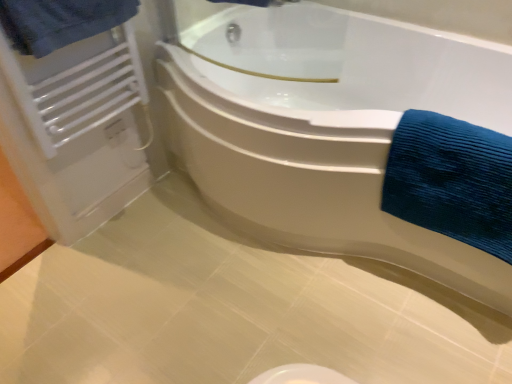
Describe the element at coordinates (451, 180) in the screenshot. I see `blue textured towel at right, the 1th bath towel from the right` at that location.

Locate an element on the screen. The width and height of the screenshot is (512, 384). blue textured towel at upper left, which ranks as the second bath towel in bottom-to-top order is located at coordinates (60, 21).

From a real-world perspective, which is physically below, white glossy bathtub at center or white metallic radiator at upper left?

white glossy bathtub at center, from a real-world perspective.

From the image's perspective, is white glossy bathtub at center located beneath white metallic radiator at upper left?

Indeed, from the image's perspective, white glossy bathtub at center is shown beneath white metallic radiator at upper left.

Is white glossy bathtub at center in front of or behind white metallic radiator at upper left in the image?

Visually, white glossy bathtub at center is located in front of white metallic radiator at upper left.

The width and height of the screenshot is (512, 384). In order to click on bath towel above the blue textured towel at right, the 1th bath towel from the right (from the image's perspective) in this screenshot , I will do `click(60, 21)`.

Considering the relative sizes of blue textured towel at right, which ranks as the first bath towel in bottom-to-top order, and blue textured towel at upper left, the 2th bath towel positioned from the right, in the image provided, is blue textured towel at right, which ranks as the first bath towel in bottom-to-top order, thinner than blue textured towel at upper left, the 2th bath towel positioned from the right,?

No.

How different are the orientations of blue textured towel at right, the 1th bath towel from the right, and blue textured towel at upper left, the 2th bath towel positioned from the right, in degrees?

blue textured towel at right, the 1th bath towel from the right, and blue textured towel at upper left, the 2th bath towel positioned from the right, are facing 89.5 degrees away from each other.

Which is closer to the camera, [499,238] or [415,121]?

Positioned in front is point [415,121].

What's the angular difference between blue textured towel at right, the 1th bath towel from the right, and white glossy bathtub at center's facing directions?

The angle between the facing direction of blue textured towel at right, the 1th bath towel from the right, and the facing direction of white glossy bathtub at center is 2.34 degrees.

Is white glossy bathtub at center at the back of blue textured towel at right, the 2th bath towel viewed from the left?

Yes.

From the image's perspective, between blue textured towel at right, which ranks as the first bath towel in bottom-to-top order, and white glossy bathtub at center, which one is located above?

white glossy bathtub at center, from the image's perspective.

Can you tell me how much white metallic radiator at upper left and blue textured towel at upper left, which appears as the 1th bath towel when viewed from the top, differ in facing direction?

They differ by 0.00124 degrees in their facing directions.

Is white metallic radiator at upper left positioned before blue textured towel at upper left, which ranks as the second bath towel in bottom-to-top order?

No, white metallic radiator at upper left is further to the viewer.

From a real-world perspective, which is physically below, white metallic radiator at upper left or blue textured towel at upper left, which ranks as the second bath towel in bottom-to-top order?

In real-world perspective, white metallic radiator at upper left is lower.

Does white metallic radiator at upper left have a larger size compared to blue textured towel at upper left, which ranks as the second bath towel in bottom-to-top order?

Indeed, white metallic radiator at upper left has a larger size compared to blue textured towel at upper left, which ranks as the second bath towel in bottom-to-top order.

Is the position of blue textured towel at right, which ranks as the first bath towel in bottom-to-top order, more distant than that of white metallic radiator at upper left?

No, the depth of blue textured towel at right, which ranks as the first bath towel in bottom-to-top order, is less than that of white metallic radiator at upper left.

Does blue textured towel at right, which ranks as the first bath towel in bottom-to-top order, appear on the left side of white metallic radiator at upper left?

In fact, blue textured towel at right, which ranks as the first bath towel in bottom-to-top order, is to the right of white metallic radiator at upper left.

From a real-world perspective, is blue textured towel at right, the 2th bath towel viewed from the left, over white metallic radiator at upper left?

Actually, blue textured towel at right, the 2th bath towel viewed from the left, is physically below white metallic radiator at upper left in the real world.

Locate an element on the screen. The image size is (512, 384). bath towel directly beneath the white metallic radiator at upper left (from a real-world perspective) is located at coordinates (451, 180).

Is white glossy bathtub at center facing away from blue textured towel at upper left, which appears as the 1th bath towel when viewed from the top?

No, white glossy bathtub at center is not facing the opposite direction of blue textured towel at upper left, which appears as the 1th bath towel when viewed from the top.

Can you tell me how much white glossy bathtub at center and blue textured towel at upper left, which appears as the 1th bath towel when viewed from the top, differ in facing direction?

white glossy bathtub at center and blue textured towel at upper left, which appears as the 1th bath towel when viewed from the top, are facing 91.8 degrees away from each other.

From the image's perspective, between white glossy bathtub at center and blue textured towel at upper left, which ranks as the second bath towel in bottom-to-top order, which one is located above?

blue textured towel at upper left, which ranks as the second bath towel in bottom-to-top order, appears higher in the image.

Is white glossy bathtub at center taller than blue textured towel at upper left, which appears as the 1th bath towel when viewed from the top?

Yes, white glossy bathtub at center is taller than blue textured towel at upper left, which appears as the 1th bath towel when viewed from the top.

How distant is blue textured towel at upper left, which ranks as the second bath towel in bottom-to-top order, from blue textured towel at right, the 1th bath towel from the right?

A distance of 3.51 feet exists between blue textured towel at upper left, which ranks as the second bath towel in bottom-to-top order, and blue textured towel at right, the 1th bath towel from the right.

Considering the relative sizes of blue textured towel at upper left, the 2th bath towel positioned from the right, and blue textured towel at right, the 1th bath towel from the right, in the image provided, is blue textured towel at upper left, the 2th bath towel positioned from the right, smaller than blue textured towel at right, the 1th bath towel from the right,?

Yes.

Consider the image. Can you tell me how much blue textured towel at upper left, the 2th bath towel positioned from the right, and blue textured towel at right, the 2th bath towel viewed from the left, differ in facing direction?

There is a 89.5-degree angle between the facing directions of blue textured towel at upper left, the 2th bath towel positioned from the right, and blue textured towel at right, the 2th bath towel viewed from the left.

From the picture: From the image's perspective, is blue textured towel at upper left, the 2th bath towel positioned from the right, above or below blue textured towel at right, placed as the second bath towel when sorted from top to bottom?

Based on their image positions, blue textured towel at upper left, the 2th bath towel positioned from the right, is located above blue textured towel at right, placed as the second bath towel when sorted from top to bottom.

In order to click on radiator on the left of the white glossy bathtub at center in this screenshot , I will do `click(75, 86)`.

Identify the location of bath towel that appears below the blue textured towel at upper left, which ranks as the second bath towel in bottom-to-top order (from a real-world perspective). (451, 180).

Consider the image. When comparing their distances from white metallic radiator at upper left, does blue textured towel at right, the 1th bath towel from the right, or white glossy bathtub at center seem further?

The object further to white metallic radiator at upper left is blue textured towel at right, the 1th bath towel from the right.

When comparing their distances from white glossy bathtub at center, does white metallic radiator at upper left or blue textured towel at upper left, the 1th bath towel in the left-to-right sequence, seem further?

The object further to white glossy bathtub at center is blue textured towel at upper left, the 1th bath towel in the left-to-right sequence.

From the image, which object appears to be farther from blue textured towel at upper left, the 1th bath towel in the left-to-right sequence, blue textured towel at right, which ranks as the first bath towel in bottom-to-top order, or white metallic radiator at upper left?

blue textured towel at right, which ranks as the first bath towel in bottom-to-top order.

Which object lies nearer to the anchor point blue textured towel at right, which ranks as the first bath towel in bottom-to-top order, white glossy bathtub at center or white metallic radiator at upper left?

Based on the image, white glossy bathtub at center appears to be nearer to blue textured towel at right, which ranks as the first bath towel in bottom-to-top order.

Consider the image. Which object lies further to the anchor point white glossy bathtub at center, blue textured towel at right, the 2th bath towel viewed from the left, or white metallic radiator at upper left?

white metallic radiator at upper left.

When comparing their distances from white metallic radiator at upper left, does blue textured towel at upper left, the 1th bath towel in the left-to-right sequence, or white glossy bathtub at center seem further?

Based on the image, white glossy bathtub at center appears to be further to white metallic radiator at upper left.

From the image, which object appears to be farther from white metallic radiator at upper left, white glossy bathtub at center or blue textured towel at upper left, which ranks as the second bath towel in bottom-to-top order?

white glossy bathtub at center lies further to white metallic radiator at upper left than the other object.

Estimate the real-world distances between objects in this image. Which object is further from blue textured towel at upper left, the 2th bath towel positioned from the right, white metallic radiator at upper left or blue textured towel at right, the 2th bath towel viewed from the left?

The object further to blue textured towel at upper left, the 2th bath towel positioned from the right, is blue textured towel at right, the 2th bath towel viewed from the left.

The height and width of the screenshot is (384, 512). In order to click on bathtub situated between white metallic radiator at upper left and blue textured towel at right, placed as the second bath towel when sorted from top to bottom, from left to right in this screenshot , I will do `click(342, 139)`.

Identify the location of bath towel situated between white metallic radiator at upper left and blue textured towel at right, which ranks as the first bath towel in bottom-to-top order, from left to right. This screenshot has height=384, width=512. (60, 21).

This screenshot has height=384, width=512. I want to click on bath towel between white metallic radiator at upper left and white glossy bathtub at center from left to right, so click(x=60, y=21).

Where is `bathtub between blue textured towel at upper left, the 1th bath towel in the left-to-right sequence, and blue textured towel at right, the 1th bath towel from the right, from left to right`? bathtub between blue textured towel at upper left, the 1th bath towel in the left-to-right sequence, and blue textured towel at right, the 1th bath towel from the right, from left to right is located at coordinates pyautogui.click(x=342, y=139).